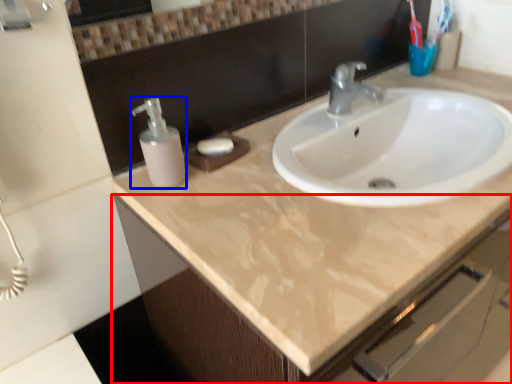
Question: Which object is further to the camera taking this photo, bathroom cabinet (highlighted by a red box) or soap dispenser (highlighted by a blue box)?

Choices:
 (A) bathroom cabinet
 (B) soap dispenser

Answer: (B)